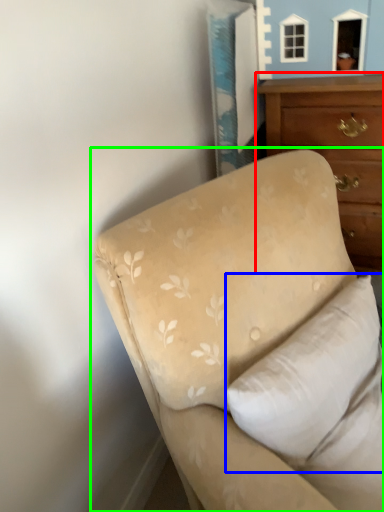
Question: Considering the real-world distances, which object is farthest from chest of drawers (highlighted by a red box)? pillow (highlighted by a blue box) or studio couch (highlighted by a green box)?

Choices:
 (A) pillow
 (B) studio couch

Answer: (A)